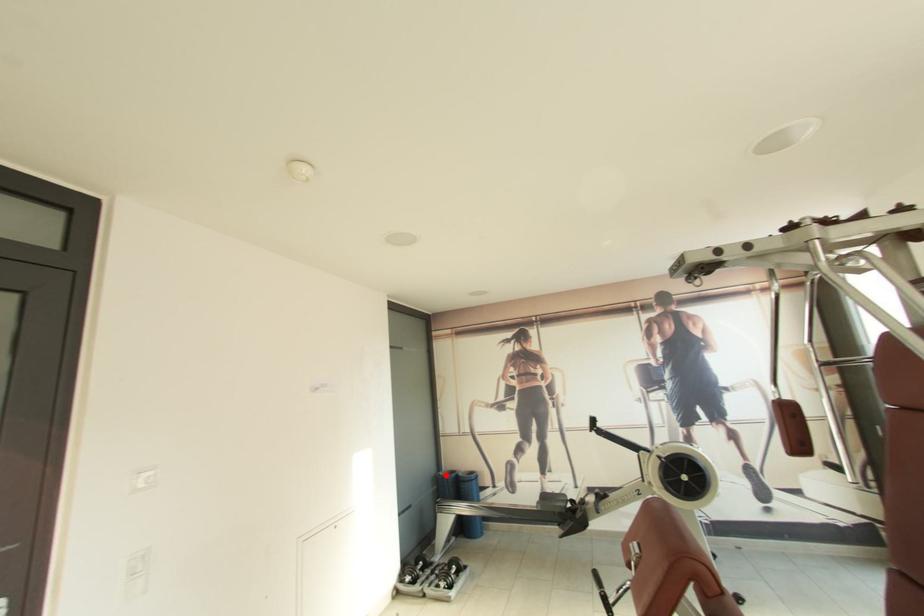
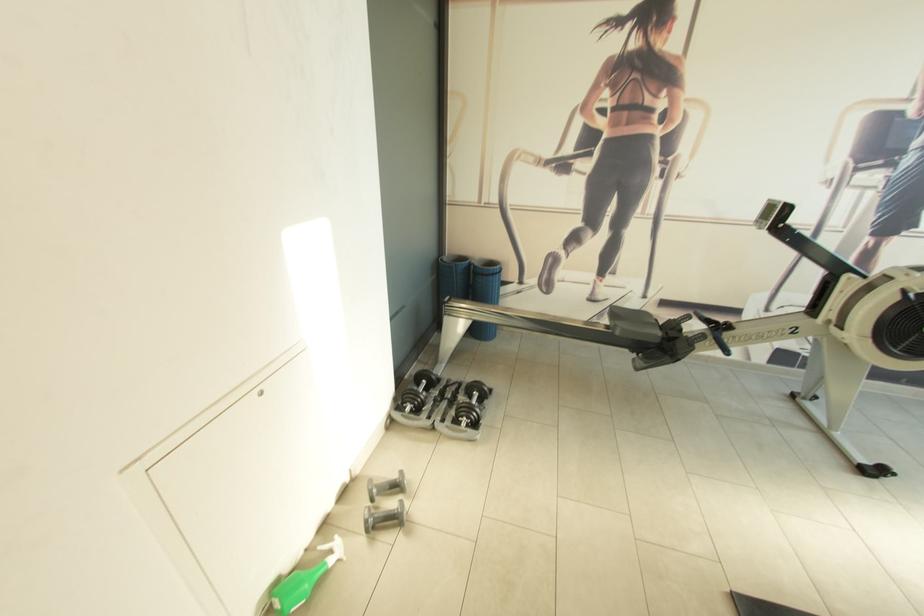
Question: I am providing you with two images of the same scene from different viewpoints. A red point is shown in image1. For the corresponding object point in image2, is it positioned nearer or farther from the camera?

Choices:
 (A) Nearer
 (B) Farther

Answer: (A)